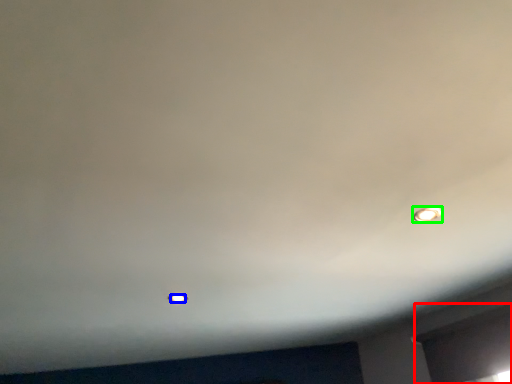
Question: Considering the real-world distances, which object is farthest from window (highlighted by a red box)? light bulb (highlighted by a blue box) or light bulb (highlighted by a green box)?

Choices:
 (A) light bulb
 (B) light bulb

Answer: (A)